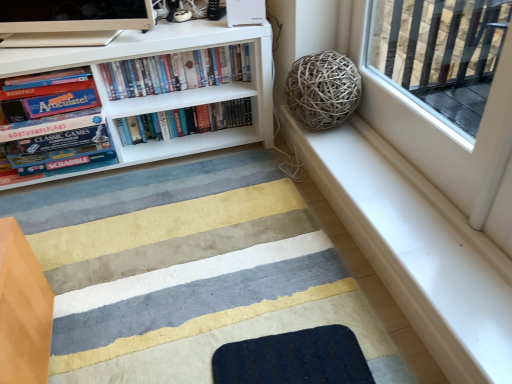
Question: From a real-world perspective, is dark blue textured mat at lower center, which is the second doormat in front-to-back order, positioned above or below white matte bookcase at upper left?

Choices:
 (A) above
 (B) below

Answer: (B)

Question: Is dark blue textured mat at lower center, which ranks as the first doormat in back-to-front order, wider or thinner than white matte bookcase at upper left?

Choices:
 (A) thin
 (B) wide

Answer: (B)

Question: Which of these objects is positioned closest to the hardcover books at center, the 1th book viewed from the right?

Choices:
 (A) textured wool doormat at lower center, placed as the first doormat when sorted from front to back
 (B) matte board game at left, the third book in the right-to-left sequence
 (C) hardcover books at center, positioned as the 2th book in left-to-right order
 (D) white smooth window sill at upper right
 (E) white matte bookcase at upper left

Answer: (E)

Question: Which is nearer to the textured wool doormat at lower center, which is the second doormat in back-to-front order?

Choices:
 (A) white matte bookcase at upper left
 (B) hardcover books at center, positioned as the 2th book in left-to-right order
 (C) dark blue textured mat at lower center, which is the second doormat in front-to-back order
 (D) matte board game at left, the third book in the right-to-left sequence
 (E) white smooth window sill at upper right

Answer: (C)